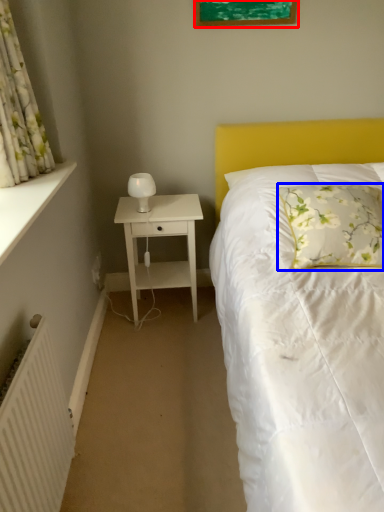
Question: Which object is further to the camera taking this photo, picture frame (highlighted by a red box) or pillow (highlighted by a blue box)?

Choices:
 (A) picture frame
 (B) pillow

Answer: (A)